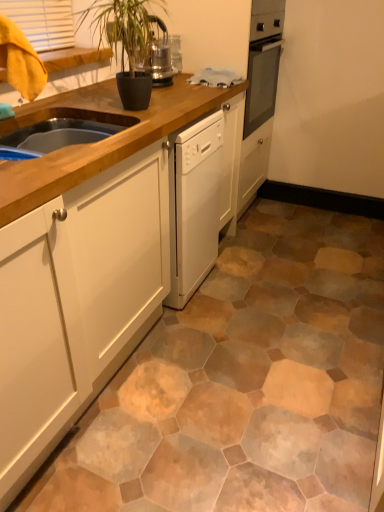
The height and width of the screenshot is (512, 384). I want to click on free point behind dark green glossy plant at upper center, so click(x=161, y=90).